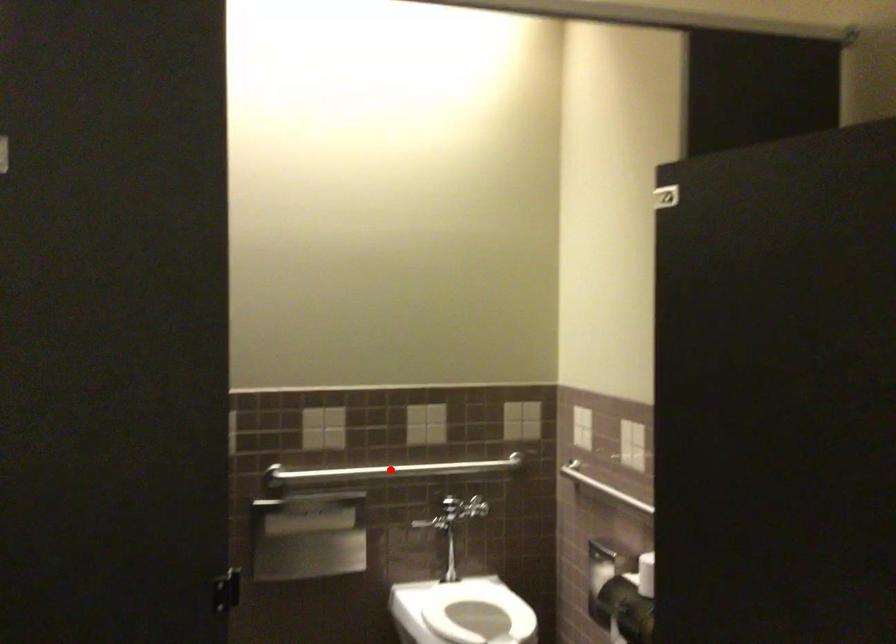
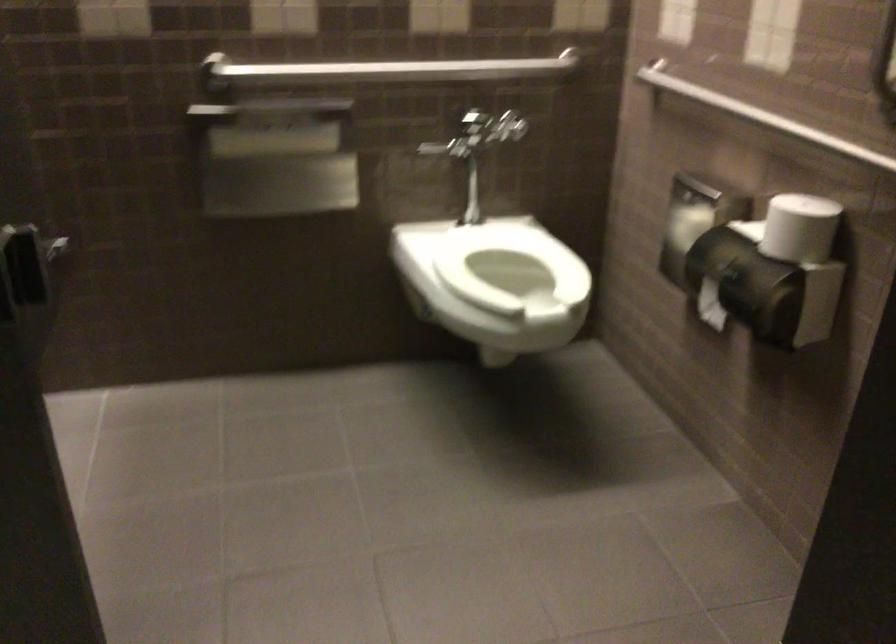
Where in the second image is the point corresponding to the highlighted location from the first image?

(391, 69)